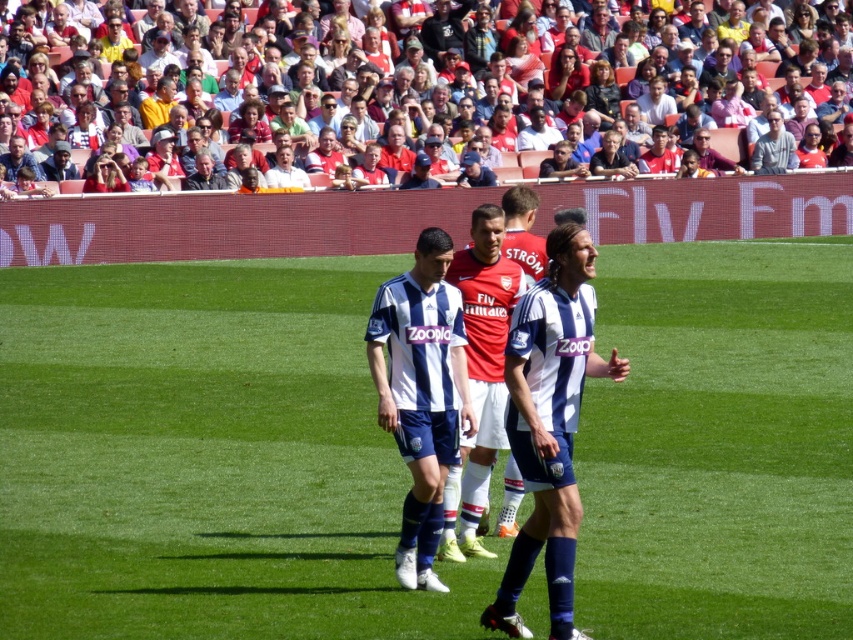
From the picture: You are a drone operator trying to capture the best aerial shot of the soccer match. The point at coordinates (204, 458) is marked on your screen. Based on the scene description, what significant feature does this point likely represent?

The point at coordinates (204, 458) marks the green grass football field at center, which is the central area of the soccer match where most of the action occurs.

You are standing at the point labeled as point (775, 140) in the soccer field. You want to throw a ball to a friend who is watching the game in the stands. The distance between you and the viewer is 35.71 meters. Can you estimate if you can throw the ball to reach your friend?

The distance between point (775, 140) and the viewer is 35.71 meters. Since the average throwing distance for a person is around 30 meters, it might be challenging to reach 35.71 meters. Therefore, it is unlikely you can throw the ball that far to reach your friend.

You are a photographer standing at the center of the soccer field. You want to take a photo of both point (775, 131) and point (285, 172). Which point is closer to your camera?

Point (285, 172) is closer to the camera than point (775, 131) because the description states that point (775, 131) is further to the camera than point (285, 172).